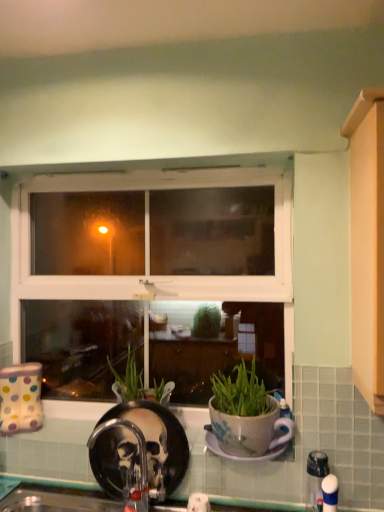
Where is `porcelain plate at center`? porcelain plate at center is located at coordinates tap(240, 456).

Image resolution: width=384 pixels, height=512 pixels. What do you see at coordinates (125, 464) in the screenshot? I see `black matte faucet at lower center, the 2th faucet positioned from the right` at bounding box center [125, 464].

Locate an element on the screen. This screenshot has height=512, width=384. porcelain plate at center is located at coordinates (240, 456).

Is point (128, 485) behind point (210, 441)?

No, it is in front of (210, 441).

Image resolution: width=384 pixels, height=512 pixels. In order to click on plate on the right of black matte faucet at lower center, the 1th faucet positioned from the left in this screenshot , I will do `click(240, 456)`.

From a real-world perspective, between black matte faucet at lower center, the 1th faucet positioned from the left, and porcelain plate at center, who is vertically lower?

black matte faucet at lower center, the 1th faucet positioned from the left, is physically lower.

Which object is thinner, black matte faucet at lower center, the 1th faucet from the back, or porcelain plate at center?

With smaller width is black matte faucet at lower center, the 1th faucet from the back.

Can you confirm if white plastic window at center is shorter than white plastic faucet at lower right, which is the 1th faucet in front-to-back order?

No.

Locate an element on the screen. This screenshot has height=512, width=384. window above the white plastic faucet at lower right, the second faucet viewed from the left (from the image's perspective) is located at coordinates (148, 249).

Is white plastic window at center oriented towards white plastic faucet at lower right, acting as the 1th faucet starting from the right?

Yes, white plastic window at center faces towards white plastic faucet at lower right, acting as the 1th faucet starting from the right.

In the scene shown: From the image's perspective, is white plastic window at center on white plastic faucet at lower right, the second faucet viewed from the left?

Yes, from the image's perspective, white plastic window at center is on top of white plastic faucet at lower right, the second faucet viewed from the left.

Looking at their sizes, would you say porcelain plate at center is wider or thinner than black matte faucet at lower center, the 1th faucet from the back?

In the image, porcelain plate at center appears to be wider than black matte faucet at lower center, the 1th faucet from the back.

What's the angular difference between porcelain plate at center and black matte faucet at lower center, the 1th faucet from the back,'s facing directions?

There is a 0.432-degree angle between the facing directions of porcelain plate at center and black matte faucet at lower center, the 1th faucet from the back.

Identify the location of faucet that is the 1st object directly below the porcelain plate at center (from a real-world perspective). The height and width of the screenshot is (512, 384). (125, 464).

Is porcelain plate at center positioned with its back to black matte faucet at lower center, the second faucet when ordered from front to back?

No, black matte faucet at lower center, the second faucet when ordered from front to back, is not at the back of porcelain plate at center.

From a real-world perspective, is porcelain plate at center located higher than white plastic faucet at lower right, which is the 1th faucet in front-to-back order?

Indeed, from a real-world perspective, porcelain plate at center stands above white plastic faucet at lower right, which is the 1th faucet in front-to-back order.

Is porcelain plate at center smaller than white plastic faucet at lower right, which is the 1th faucet in front-to-back order?

Incorrect, porcelain plate at center is not smaller in size than white plastic faucet at lower right, which is the 1th faucet in front-to-back order.

Considering the relative sizes of porcelain plate at center and white plastic faucet at lower right, arranged as the 2th faucet when viewed from the back, in the image provided, is porcelain plate at center taller than white plastic faucet at lower right, arranged as the 2th faucet when viewed from the back,?

No, porcelain plate at center is not taller than white plastic faucet at lower right, arranged as the 2th faucet when viewed from the back.

Is porcelain plate at center placed right next to white plastic window at center?

No, porcelain plate at center is not in contact with white plastic window at center.

Does porcelain plate at center have a lesser width compared to white plastic window at center?

No.

Looking at this image, is porcelain plate at center bigger than white plastic window at center?

Actually, porcelain plate at center might be smaller than white plastic window at center.

Based on the photo, does black matte faucet at lower center, the 1th faucet from the back, have a smaller size compared to white plastic window at center?

Indeed, black matte faucet at lower center, the 1th faucet from the back, has a smaller size compared to white plastic window at center.

Considering the positions of points (133, 458) and (82, 278), is point (133, 458) farther from camera compared to point (82, 278)?

No, it is not.

At what (x,y) coordinates should I click in order to perform the action: click on window located above the black matte faucet at lower center, the 1th faucet positioned from the left (from the image's perspective). Please return your answer as a coordinate pair (x, y). This screenshot has width=384, height=512. Looking at the image, I should click on (148, 249).

From a real-world perspective, between black matte faucet at lower center, the 1th faucet from the back, and white plastic window at center, who is vertically lower?

In real-world perspective, black matte faucet at lower center, the 1th faucet from the back, is lower.

From the image's perspective, between white plastic faucet at lower right, acting as the 1th faucet starting from the right, and porcelain plate at center, who is located below?

white plastic faucet at lower right, acting as the 1th faucet starting from the right, is shown below in the image.

How different are the orientations of white plastic faucet at lower right, which is the 1th faucet in front-to-back order, and porcelain plate at center in degrees?

white plastic faucet at lower right, which is the 1th faucet in front-to-back order, and porcelain plate at center are facing 0.432 degrees away from each other.

Which object is thinner, white plastic faucet at lower right, arranged as the 2th faucet when viewed from the back, or porcelain plate at center?

white plastic faucet at lower right, arranged as the 2th faucet when viewed from the back.

Find the location of a particular element. The image size is (384, 512). plate above the black matte faucet at lower center, the second faucet when ordered from front to back (from a real-world perspective) is located at coordinates click(x=240, y=456).

The height and width of the screenshot is (512, 384). What are the coordinates of `window on the left of white plastic faucet at lower right, acting as the 1th faucet starting from the right` in the screenshot? It's located at (148, 249).

From the image, which object appears to be nearer to white plastic window at center, white plastic faucet at lower right, the second faucet viewed from the left, or porcelain plate at center?

porcelain plate at center is closer to white plastic window at center.

Based on their spatial positions, is white plastic faucet at lower right, the second faucet viewed from the left, or white plastic window at center further from black matte faucet at lower center, the 1th faucet from the back?

white plastic faucet at lower right, the second faucet viewed from the left, is positioned further to the anchor black matte faucet at lower center, the 1th faucet from the back.

When comparing their distances from black matte faucet at lower center, the 2th faucet positioned from the right, does white plastic faucet at lower right, acting as the 1th faucet starting from the right, or porcelain plate at center seem further?

Among the two, white plastic faucet at lower right, acting as the 1th faucet starting from the right, is located further to black matte faucet at lower center, the 2th faucet positioned from the right.

Looking at the image, which one is located closer to white plastic faucet at lower right, which is the 1th faucet in front-to-back order, white plastic window at center or porcelain plate at center?

The object closer to white plastic faucet at lower right, which is the 1th faucet in front-to-back order, is porcelain plate at center.

Based on their spatial positions, is white plastic window at center or white plastic faucet at lower right, which is the 1th faucet in front-to-back order, closer to porcelain plate at center?

white plastic faucet at lower right, which is the 1th faucet in front-to-back order, is positioned closer to the anchor porcelain plate at center.

Estimate the real-world distances between objects in this image. Which object is closer to white plastic window at center, porcelain plate at center or black matte faucet at lower center, the 2th faucet positioned from the right?

black matte faucet at lower center, the 2th faucet positioned from the right, is closer to white plastic window at center.

Which object lies nearer to the anchor point porcelain plate at center, black matte faucet at lower center, the second faucet when ordered from front to back, or white plastic faucet at lower right, acting as the 1th faucet starting from the right?

Among the two, white plastic faucet at lower right, acting as the 1th faucet starting from the right, is located nearer to porcelain plate at center.

Based on their spatial positions, is white plastic faucet at lower right, arranged as the 2th faucet when viewed from the back, or black matte faucet at lower center, the 1th faucet from the back, further from porcelain plate at center?

black matte faucet at lower center, the 1th faucet from the back, lies further to porcelain plate at center than the other object.

Image resolution: width=384 pixels, height=512 pixels. I want to click on window between black matte faucet at lower center, the 1th faucet from the back, and white plastic faucet at lower right, the second faucet viewed from the left, in the horizontal direction, so click(x=148, y=249).

The image size is (384, 512). Find the location of `plate between white plastic window at center and black matte faucet at lower center, the 2th faucet positioned from the right, from top to bottom`. plate between white plastic window at center and black matte faucet at lower center, the 2th faucet positioned from the right, from top to bottom is located at coordinates (240, 456).

I want to click on plate situated between black matte faucet at lower center, the 1th faucet positioned from the left, and white plastic faucet at lower right, which is the 1th faucet in front-to-back order, from left to right, so click(240, 456).

Where is `plate between white plastic window at center and white plastic faucet at lower right, which is the 1th faucet in front-to-back order, in the vertical direction`? The image size is (384, 512). plate between white plastic window at center and white plastic faucet at lower right, which is the 1th faucet in front-to-back order, in the vertical direction is located at coordinates (240, 456).